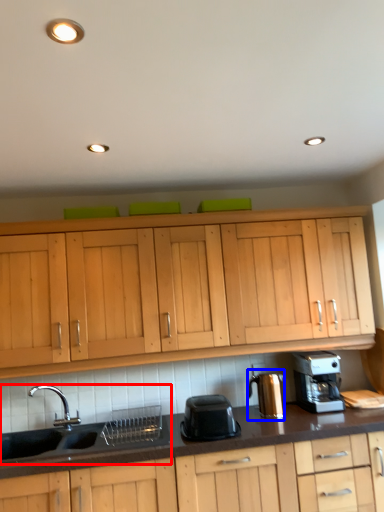
Question: Which object is closer to the camera taking this photo, sink (highlighted by a red box) or coffee machine (highlighted by a blue box)?

Choices:
 (A) sink
 (B) coffee machine

Answer: (A)